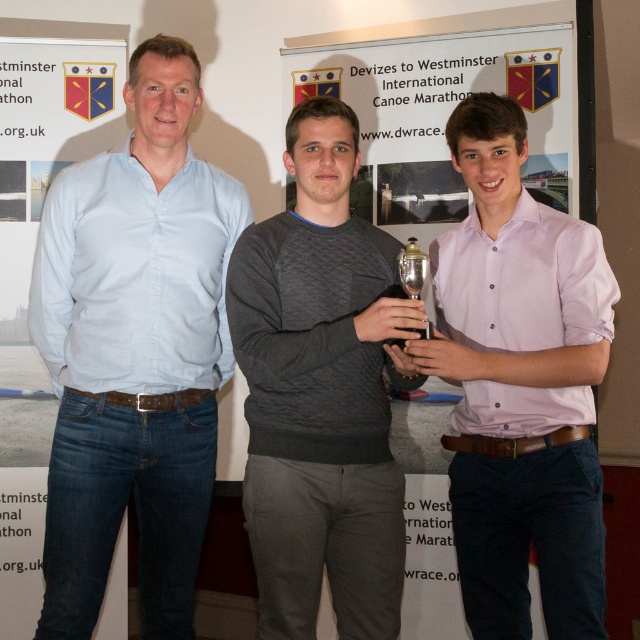
Question: Does light blue shirt at left appear under white paper at center?

Choices:
 (A) yes
 (B) no

Answer: (A)

Question: Which object is positioned farthest from the white paper at center?

Choices:
 (A) metallic gold trophy at center
 (B) pink satin shirt at center

Answer: (A)

Question: Which object is the closest to the metallic gold trophy at center?

Choices:
 (A) white paper at center
 (B) light blue shirt at left

Answer: (A)

Question: Which object is positioned closest to the dark grey textured sweater at center?

Choices:
 (A) pink satin shirt at center
 (B) metallic gold trophy at center
 (C) light blue shirt at left
 (D) white paper at center

Answer: (B)

Question: Does dark grey textured sweater at center appear on the left side of white paper at center?

Choices:
 (A) yes
 (B) no

Answer: (A)

Question: In this image, where is pink satin shirt at center located relative to white paper at center?

Choices:
 (A) left
 (B) right

Answer: (B)